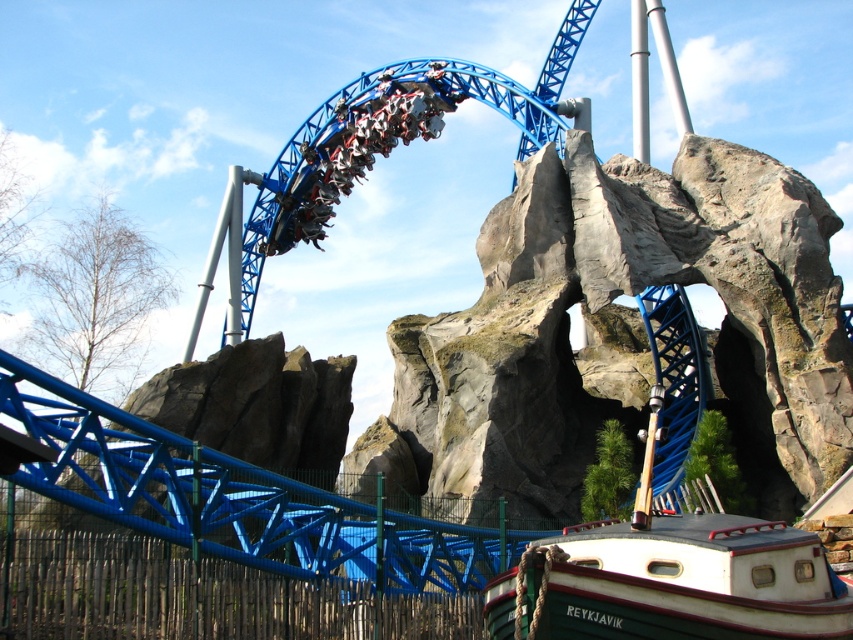
You are a visitor at the amusement park and want to take a photo of the shiny blue roller coaster at upper center without the white matte boat at lower right appearing in the frame. Which side should you stand to take the photo?

To avoid the white matte boat at lower right in your photo, stand to the left side of the shiny blue roller coaster at upper center since the boat is positioned on the right side of it.

From the picture: You are a visitor at the amusement park and want to take a photo of both the white matte boat at lower right and the shiny blue roller coaster at upper center. Can you position yourself so that both are in the same frame without moving either object?

Yes, since the white matte boat at lower right is closer to the viewer than the shiny blue roller coaster at upper center, you can position yourself so that both are in the same frame by adjusting your angle or zoom to include both objects at different distances.

You are standing at the amusement park and want to take a photo of the roller coaster. There are two points marked in the image. The first point is at coordinates point (808, 636), and the second is at point (502, 106). Which point will appear larger in your photo?

Point (808, 636) will appear larger in the photo because it is closer to the camera than point (502, 106).